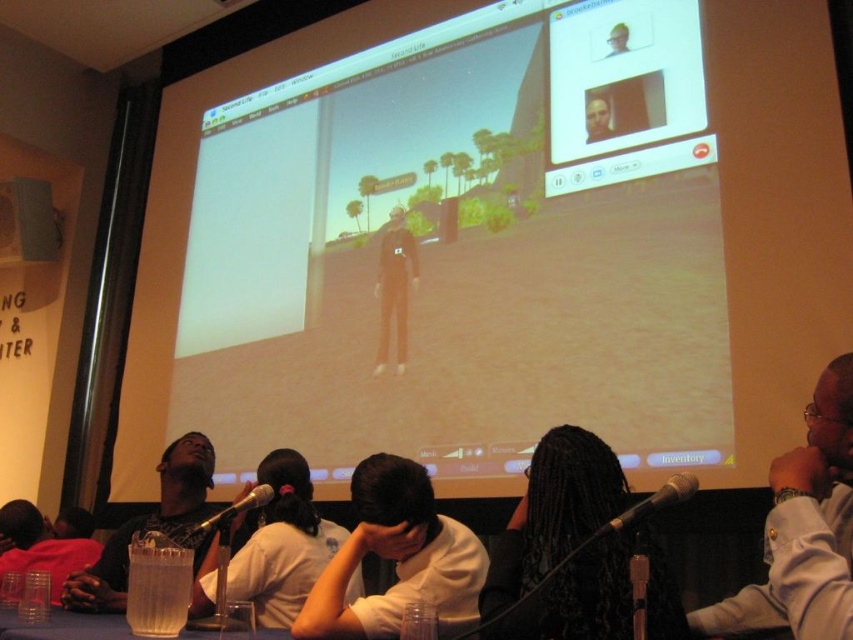
You are a photographer in the conference room. You want to take a photo of the black hair at center and the black matte microphone at center so that both are clearly visible. Considering their heights, which object should you position closer to the camera to ensure both are fully visible in the frame?

The black hair at center is much taller than the black matte microphone at center. To ensure both are fully visible in the frame, you should position the black matte microphone at center closer to the camera so that its smaller size can be captured adequately alongside the taller black hair at center.

You are standing in the conference room and want to locate the person wearing the white matte shirt at lower right. According to the coordinates provided, where exactly is this person positioned in the room?

The white matte shirt at lower right is located at coordinates point (x=804, y=529).

You are a photographer trying to capture a closeup of the metallic silver microphone at lower center while also including the matte black shirt at lower left in the frame. Based on their positions, will you need to adjust your camera angle upwards or downwards to include both?

The matte black shirt at lower left is below the metallic silver microphone at lower center, so you will need to adjust your camera angle downwards to capture both the metallic silver microphone at lower center and the matte black shirt at lower left in the frame.